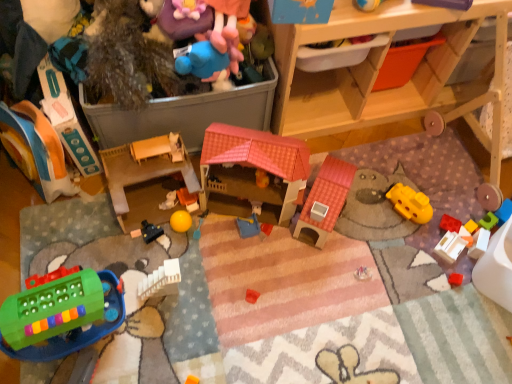
You are a GUI agent. You are given a task and a screenshot of the screen. Output one action in this format:
    pyautogui.click(x=<x>, y=<y>)
    Task: Click on the vacant area that lies between green plastic building block at lower left, positioned as the 11th toy in right-to-left order, and white plastic toy at lower right, positioned as the 4th toy in right-to-left order
    The image size is (512, 384).
    Given the screenshot: What is the action you would take?
    pyautogui.click(x=278, y=288)